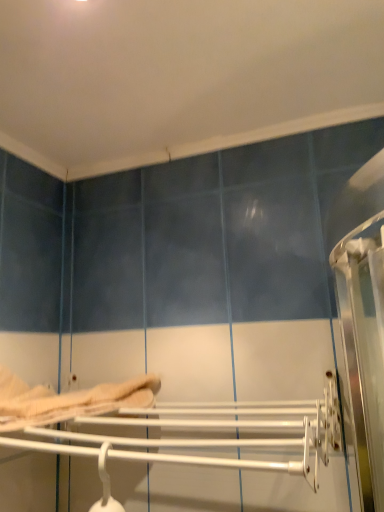
Question: Relative to beige fabric bed at lower left, is white glossy towel rack at center in front or behind?

Choices:
 (A) front
 (B) behind

Answer: (A)

Question: Is white glossy towel rack at center inside the boundaries of beige fabric bed at lower left, or outside?

Choices:
 (A) inside
 (B) outside

Answer: (B)

Question: In terms of height, does white glossy towel rack at center look taller or shorter compared to beige fabric bed at lower left?

Choices:
 (A) tall
 (B) short

Answer: (A)

Question: From the image's perspective, is beige fabric bed at lower left positioned above or below white glossy towel rack at center?

Choices:
 (A) below
 (B) above

Answer: (B)

Question: From a real-world perspective, is beige fabric bed at lower left above or below white glossy towel rack at center?

Choices:
 (A) above
 (B) below

Answer: (A)

Question: Would you say beige fabric bed at lower left is inside or outside white glossy towel rack at center?

Choices:
 (A) outside
 (B) inside

Answer: (A)

Question: Based on their sizes in the image, would you say beige fabric bed at lower left is bigger or smaller than white glossy towel rack at center?

Choices:
 (A) big
 (B) small

Answer: (B)